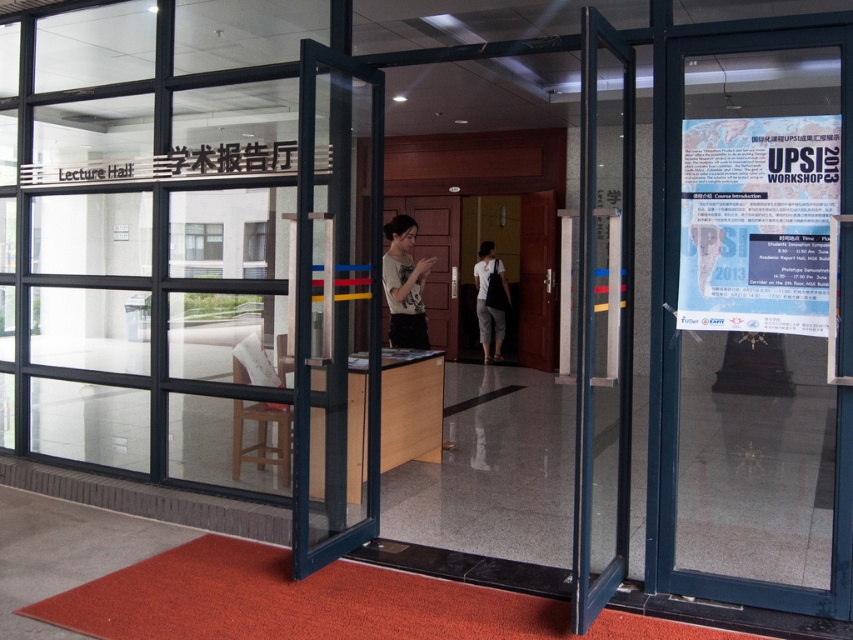
Can you confirm if transparent glass door at right is positioned below matte white t-shirt at center?

Indeed, transparent glass door at right is positioned under matte white t-shirt at center.

Is transparent glass door at right to the right of matte white t-shirt at center from the viewer's perspective?

Indeed, transparent glass door at right is positioned on the right side of matte white t-shirt at center.

Between point (793, 417) and point (402, 241), which one is positioned behind?

Positioned behind is point (793, 417).

Identify the location of transparent glass door at right. point(752,324).

At what (x,y) coordinates should I click in order to perform the action: click on matte white t-shirt at center. Please return your answer as a coordinate pair (x, y). The width and height of the screenshot is (853, 640). Looking at the image, I should click on (404, 284).

Which of these two, matte white t-shirt at center or white cotton shirt at center, stands shorter?

With less height is matte white t-shirt at center.

What do you see at coordinates (404, 284) in the screenshot? I see `matte white t-shirt at center` at bounding box center [404, 284].

Where is `matte white t-shirt at center`? Image resolution: width=853 pixels, height=640 pixels. matte white t-shirt at center is located at coordinates (404, 284).

Is transparent glass door at right further to camera compared to white cotton shirt at center?

No, transparent glass door at right is in front of white cotton shirt at center.

Does transparent glass door at right appear under white cotton shirt at center?

Yes.

Is point (735, 49) less distant than point (480, 317)?

Yes.

I want to click on transparent glass door at right, so click(x=752, y=324).